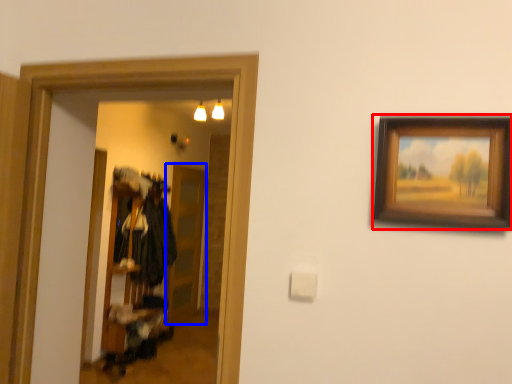
Question: Among these objects, which one is farthest to the camera, picture frame (highlighted by a red box) or glass door (highlighted by a blue box)?

Choices:
 (A) picture frame
 (B) glass door

Answer: (B)